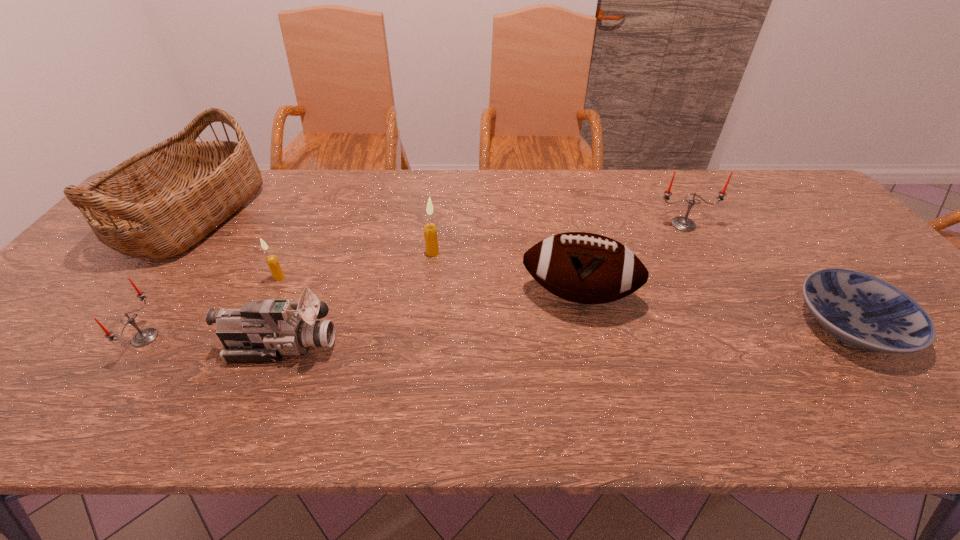
At what (x,y) coordinates should I click in order to perform the action: click on object that can be found as the fifth closest to the left cream candle. Please return your answer as a coordinate pair (x, y). This screenshot has width=960, height=540. Looking at the image, I should click on (586, 268).

Select which object appears as the sixth closest to the camcorder. Please provide its 2D coordinates. Your answer should be formatted as a tuple, i.e. [(x, y)], where the tuple contains the x and y coordinates of a point satisfying the conditions above.

[(685, 224)]

Identify which candle is the third closest to the nearest candle. Please provide its 2D coordinates. Your answer should be formatted as a tuple, i.e. [(x, y)], where the tuple contains the x and y coordinates of a point satisfying the conditions above.

[(685, 224)]

Locate an element on the screen. the third closest candle to the camcorder is located at coordinates pyautogui.click(x=430, y=231).

You are a GUI agent. You are given a task and a screenshot of the screen. Output one action in this format:
    pyautogui.click(x=<x>, y=<y>)
    Task: Click on the vacant space that satisfies the following two spatial constraints: 1. on the front side of the second farthest candle; 2. on the left side of the sixth object from left to right
    This screenshot has height=540, width=960.
    Given the screenshot: What is the action you would take?
    pyautogui.click(x=427, y=294)

The image size is (960, 540). I want to click on free space that satisfies the following two spatial constraints: 1. on the front-facing side of the rightmost candle; 2. on the front-facing side of the camcorder, so click(749, 345).

You are a GUI agent. You are given a task and a screenshot of the screen. Output one action in this format:
    pyautogui.click(x=<x>, y=<y>)
    Task: Click on the free space that satisfies the following two spatial constraints: 1. on the front-facing side of the farther red candle; 2. on the front-facing side of the left red candle
    The height and width of the screenshot is (540, 960).
    Given the screenshot: What is the action you would take?
    pyautogui.click(x=745, y=338)

You are a GUI agent. You are given a task and a screenshot of the screen. Output one action in this format:
    pyautogui.click(x=<x>, y=<y>)
    Task: Click on the free location that satisfies the following two spatial constraints: 1. on the front side of the tallest object; 2. on the right side of the shortest object
    
    Given the screenshot: What is the action you would take?
    pyautogui.click(x=107, y=325)